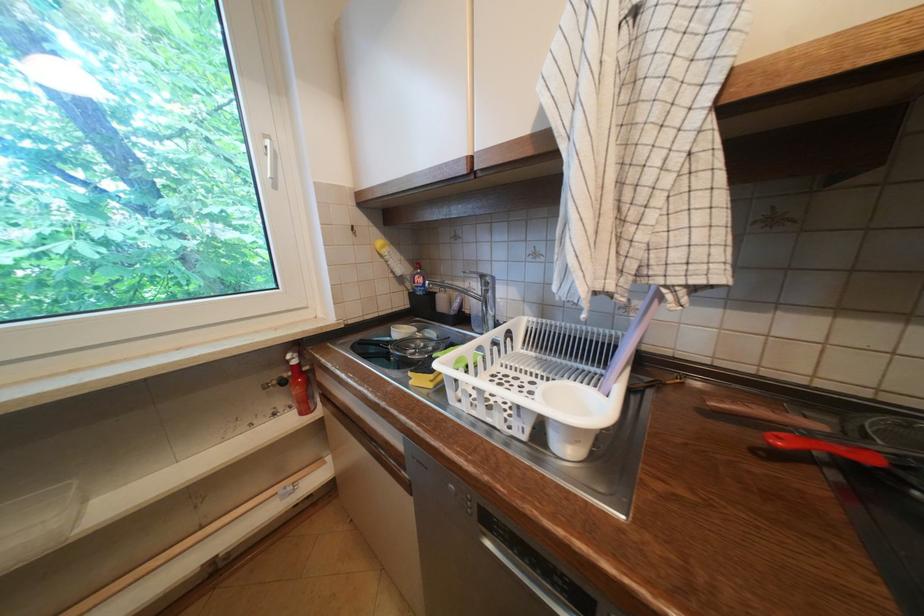
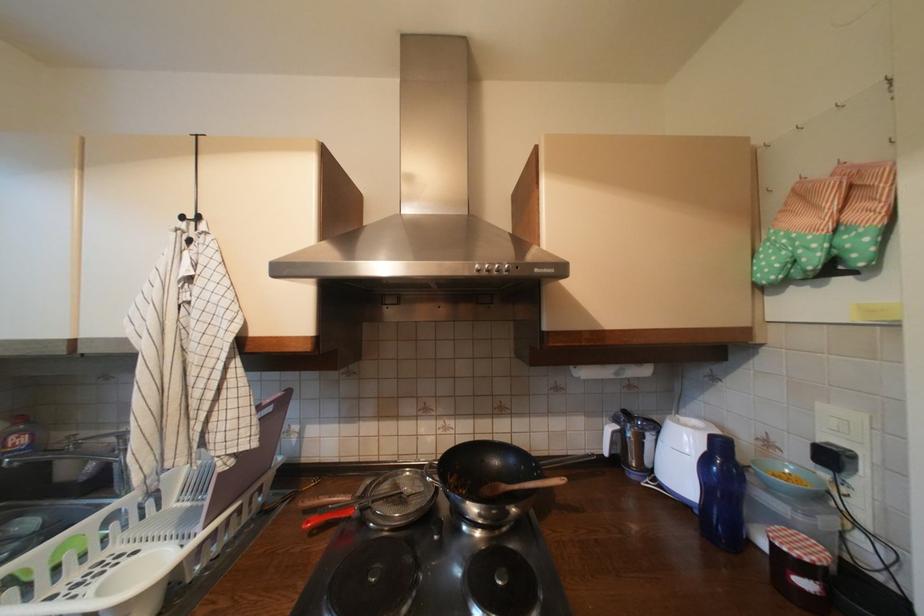
Find the pixel in the second image that matches point (788, 440) in the first image.

(317, 524)